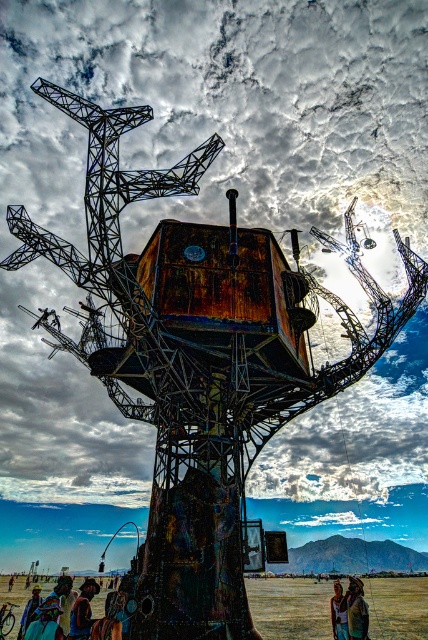
You are an artist planning to place a new sculpture in the dirt field at lower center. The sculpture requires a base that is wider than the yellowish skin tone at lower center. Can the brown dirt field at lower center accommodate this requirement?

The brown dirt field at lower center might be wider than the yellowish skin tone at lower center, so it could potentially accommodate the sculpture base if the dirt field is indeed wider. However, the exact width is uncertain based on the given information.

You are an artist trying to place a new sculpture between the dark brown leather jacket at lower left and the yellowish skin tone at lower center. Which object should you move to make space, and why?

You should move the dark brown leather jacket at lower left because its width is larger than the yellowish skin tone at lower center, so moving it would create more space for the new sculpture.

You are standing at the base of the art installation and want to walk to the brown dirt field at lower center. According to the coordinates provided, in which direction should you head from the sculpture?

The brown dirt field at lower center is located at coordinates point [290,608], which means it is positioned to the right and slightly below the central area of the image. From the sculpture, you should head towards the lower right direction to reach the brown dirt field at lower center.